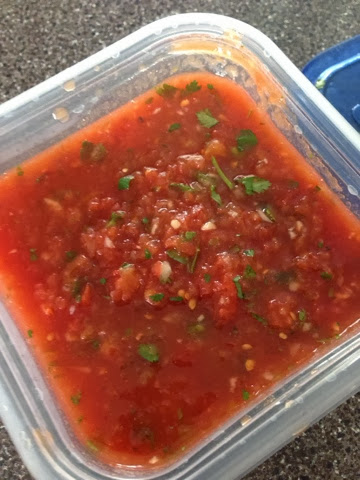
Locate an element on the screen. plastic lid is located at coordinates (351, 76).